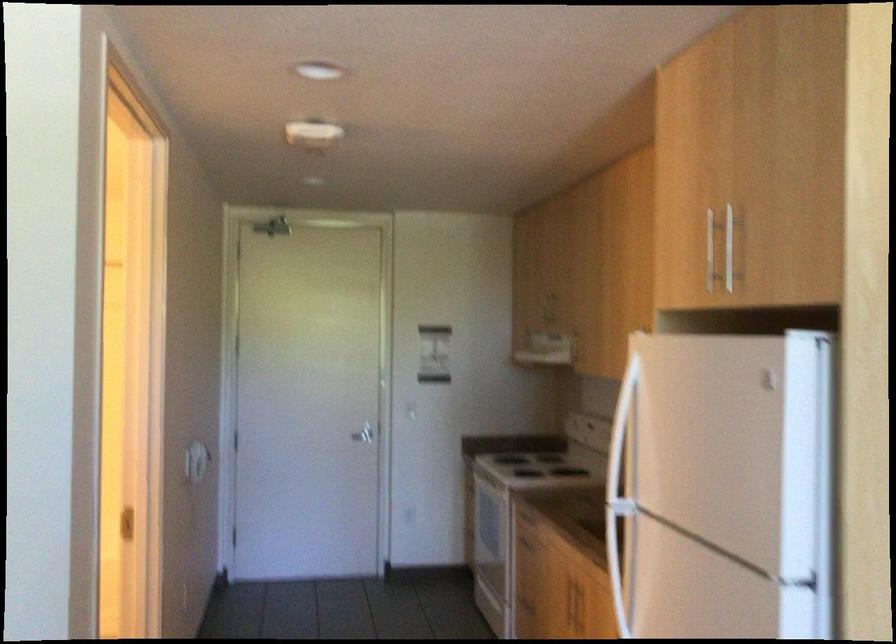
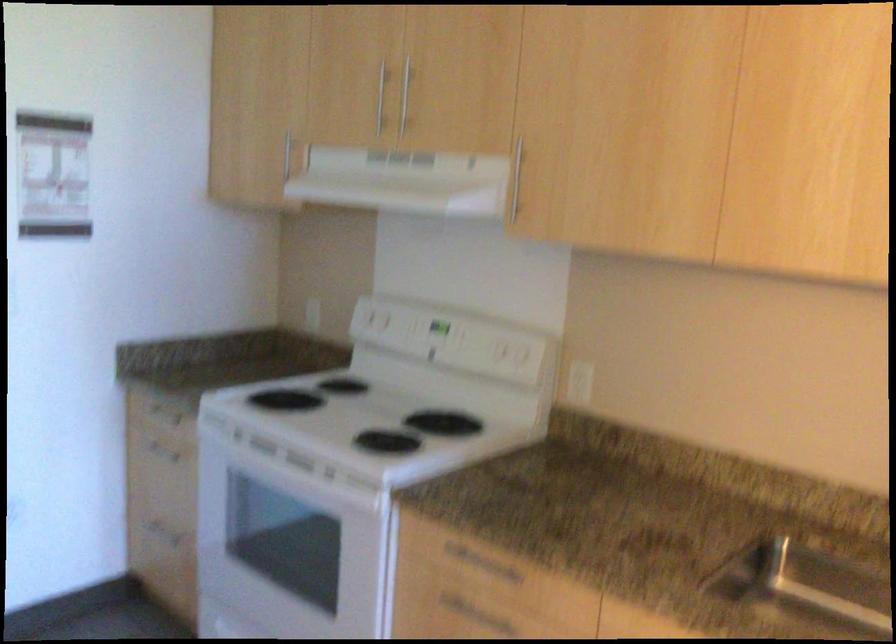
Locate, in the second image, the point that corresponds to (519,512) in the first image.

(385, 571)